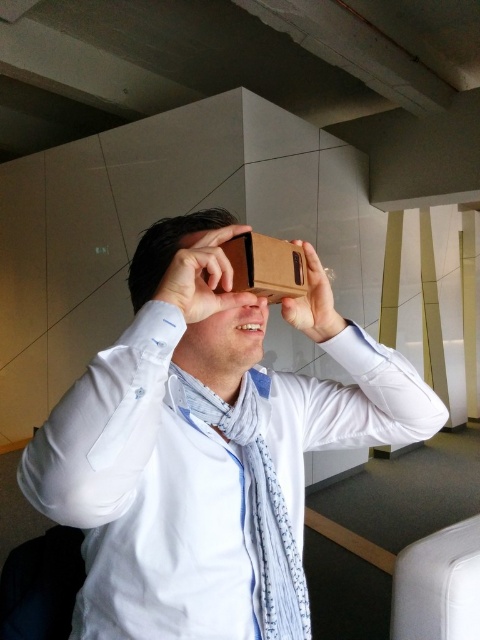
Question: Is matte cardboard at center smaller than cardboard at center?

Choices:
 (A) no
 (B) yes

Answer: (B)

Question: Does brown cardboard vr viewer at center have a lesser width compared to brown cardboard at upper center?

Choices:
 (A) no
 (B) yes

Answer: (A)

Question: From the image, what is the correct spatial relationship of brown cardboard vr viewer at center in relation to light blue textured scarf at center?

Choices:
 (A) above
 (B) below

Answer: (A)

Question: Which object is the closest to the cardboard at center?

Choices:
 (A) brown cardboard at center
 (B) brown cardboard at upper center
 (C) brown cardboard vr viewer at center

Answer: (A)

Question: Which object is farther from the camera taking this photo?

Choices:
 (A) cardboard at center
 (B) brown cardboard vr viewer at center

Answer: (A)

Question: Based on their relative distances, which object is nearer to the brown cardboard at upper center?

Choices:
 (A) brown cardboard at center
 (B) matte cardboard at center
 (C) brown cardboard vr viewer at center

Answer: (A)